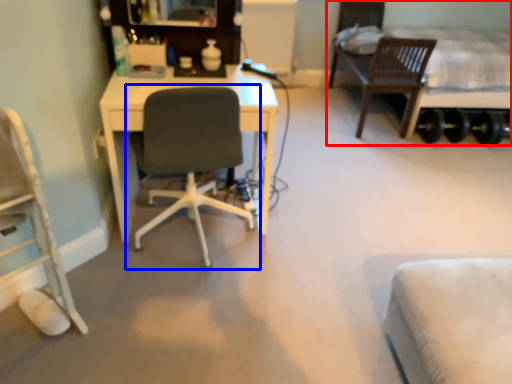
Question: Among these objects, which one is nearest to the camera, bed (highlighted by a red box) or chair (highlighted by a blue box)?

Choices:
 (A) bed
 (B) chair

Answer: (B)